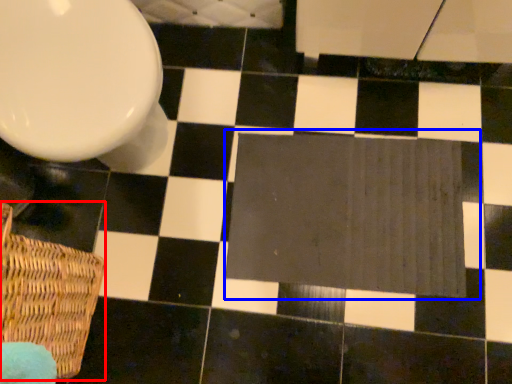
Question: Which point is closer to the camera, basket (highlighted by a red box) or bath mat (highlighted by a blue box)?

Choices:
 (A) basket
 (B) bath mat

Answer: (A)